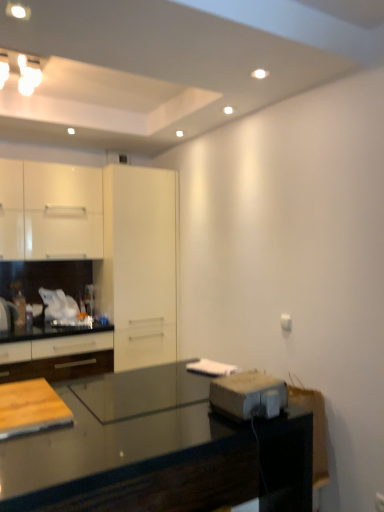
At what (x,y) coordinates should I click in order to perform the action: click on vacant area on top of wooden cutting board at lower left (from a real-world perspective). Please return your answer as a coordinate pair (x, y). This screenshot has width=384, height=512. Looking at the image, I should click on (25, 392).